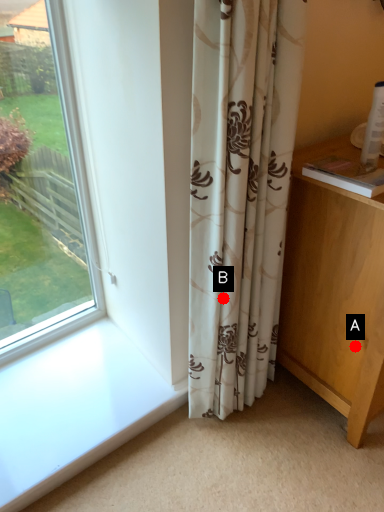
Question: Two points are circled on the image, labeled by A and B beside each circle. Which point is closer to the camera?

Choices:
 (A) A is closer
 (B) B is closer

Answer: (B)